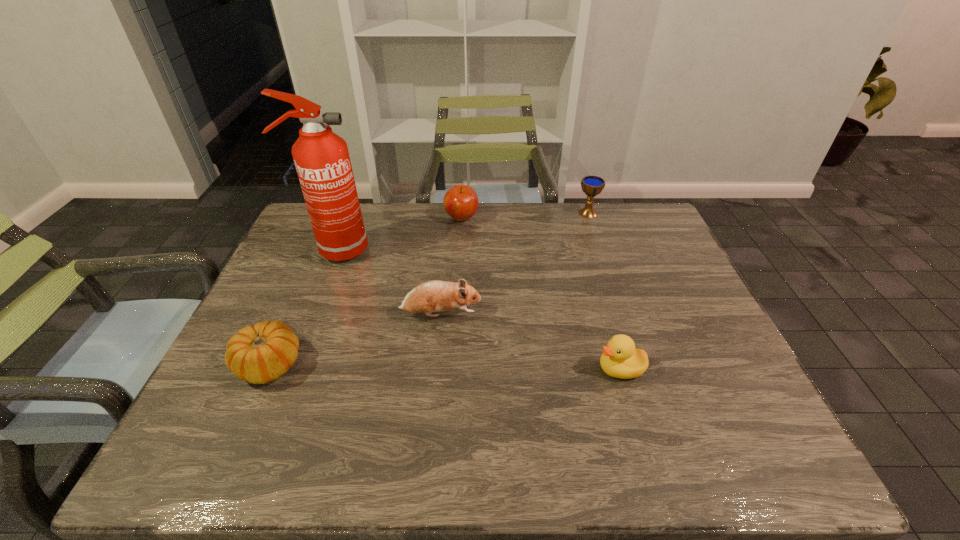
Where is `free spot that satisfies the following two spatial constraints: 1. at the nozzle of the tallest object; 2. on the front side of the gourd`? free spot that satisfies the following two spatial constraints: 1. at the nozzle of the tallest object; 2. on the front side of the gourd is located at coordinates (288, 365).